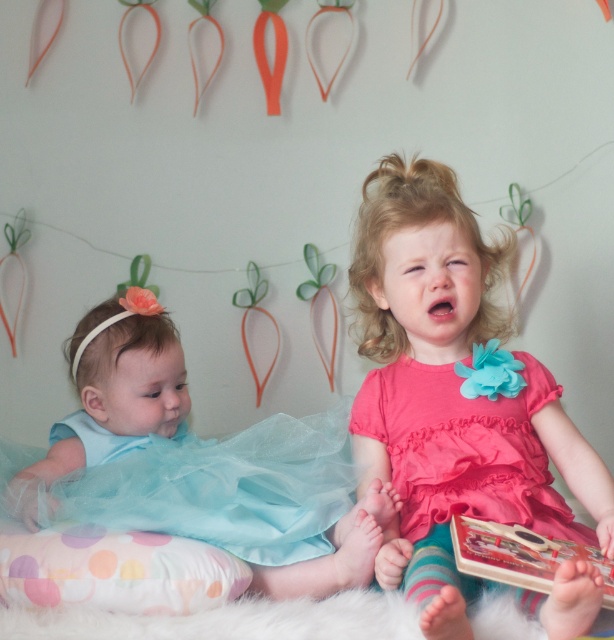
You are a toy delivery robot that needs to place a 12 inch long stuffed bear between the light blue tulle dress at lower left and the hardcover book at lower right. Will the bear fit in the space between them?

The light blue tulle dress at lower left and hardcover book at lower right are 15.66 inches apart. Since the stuffed bear is 12 inches long, it will fit between them with about 3.66 inches of space remaining.

You are a photographer trying to capture a closeup of the carrot decorations on the wall. You notice two points marked in the image. Which point, point (569, 449) or point (117, 369), is closer to your camera lens?

Point (569, 449) is closer to the camera than point (117, 369), so it would be the better choice for a closeup of the carrot decorations.

You are a photographer trying to capture a clear photo of the hardcover book at lower right. However, the light blue tulle dress at lower left is blocking your view. Can you move the dress to the side to get a better shot?

The hardcover book at lower right is behind the light blue tulle dress at lower left, so moving the dress to the side would allow you to see the book clearly.